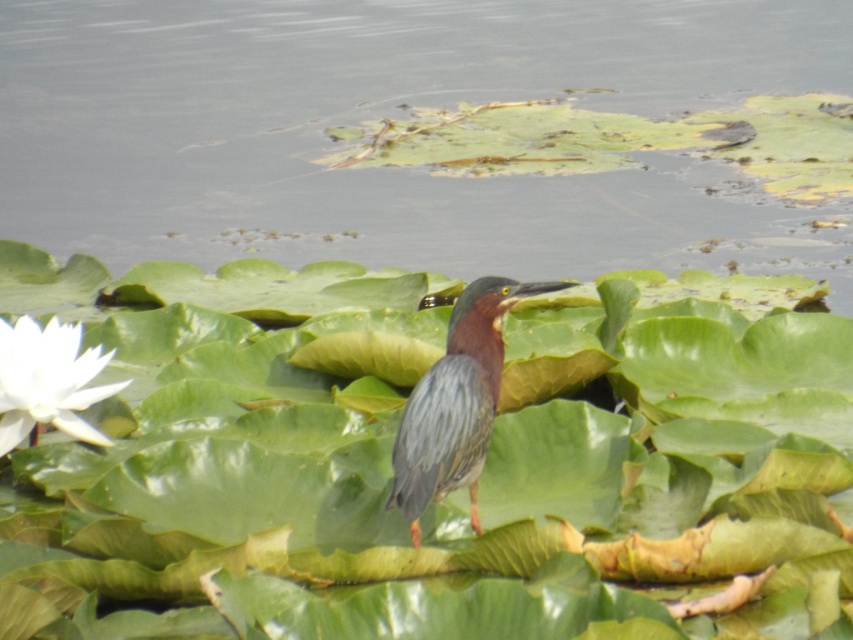
Question: Is clear water at center behind green glossy heron at center?

Choices:
 (A) yes
 (B) no

Answer: (A)

Question: Which point is farther from the camera taking this photo?

Choices:
 (A) (482, 436)
 (B) (312, 93)

Answer: (B)

Question: Among these points, which one is farthest from the camera?

Choices:
 (A) (392, 506)
 (B) (59, 48)

Answer: (B)

Question: Does clear water at center have a larger size compared to green glossy heron at center?

Choices:
 (A) no
 (B) yes

Answer: (B)

Question: Does clear water at center appear over green glossy heron at center?

Choices:
 (A) no
 (B) yes

Answer: (B)